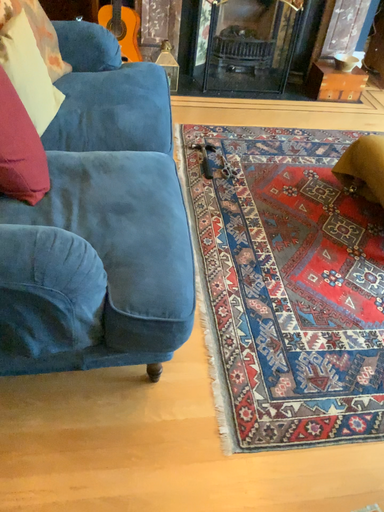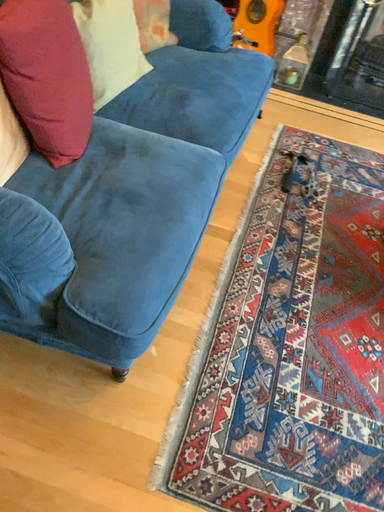
Question: Which way did the camera rotate in the video?

Choices:
 (A) rotated left
 (B) rotated right

Answer: (A)